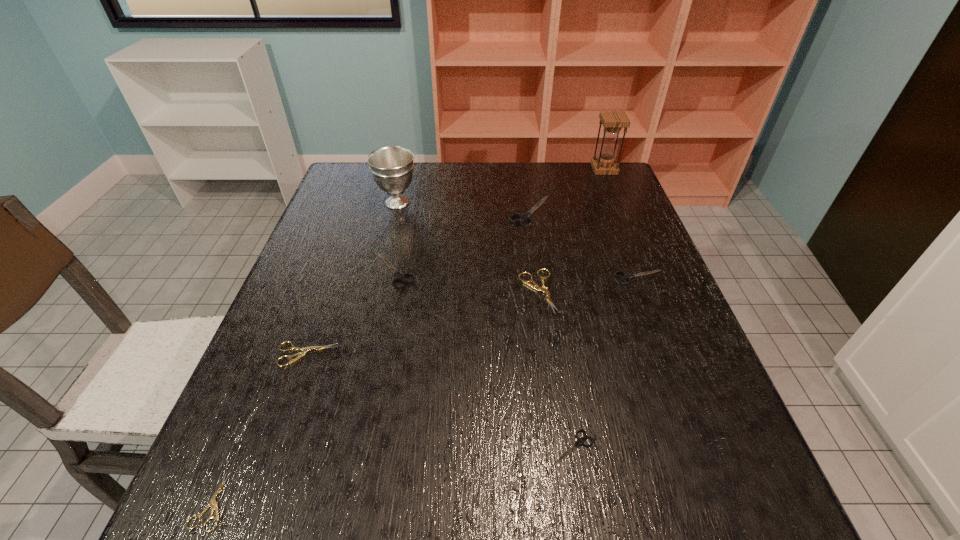
The image size is (960, 540). Identify the location of the rightmost beige shears. (535, 286).

At what (x,y) coordinates should I click in order to perform the action: click on the fifth farthest shears. Please return your answer as a coordinate pair (x, y). This screenshot has width=960, height=540. Looking at the image, I should click on (304, 350).

This screenshot has width=960, height=540. Identify the location of the second biggest beige shears. (304, 350).

Identify the location of the nearest black shears. This screenshot has height=540, width=960. (579, 441).

Locate an element on the screen. This screenshot has width=960, height=540. the second nearest object is located at coordinates (579, 441).

Locate an element on the screen. This screenshot has height=540, width=960. the shortest object is located at coordinates (212, 502).

Locate an element on the screen. The image size is (960, 540). the nearest beige shears is located at coordinates (212, 502).

At what (x,y) coordinates should I click in order to perform the action: click on free space located on the front of the farthest object. Please return your answer as a coordinate pair (x, y). Image resolution: width=960 pixels, height=540 pixels. Looking at the image, I should click on (634, 242).

I want to click on free spot located on the front of the second tallest object, so click(x=369, y=320).

What are the coordinates of `vacant area situated 0.390m on the front of the farthest black shears` in the screenshot? It's located at (548, 338).